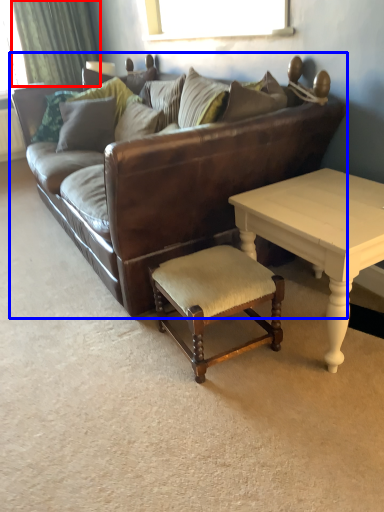
Question: Which object appears closest to the camera in this image, curtain (highlighted by a red box) or studio couch (highlighted by a blue box)?

Choices:
 (A) curtain
 (B) studio couch

Answer: (B)